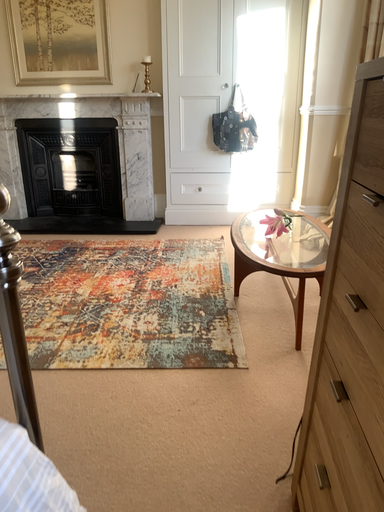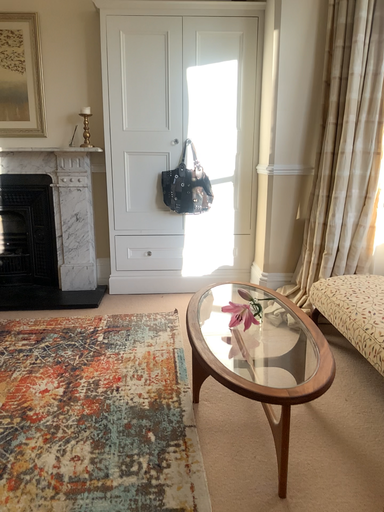
Question: Which way did the camera rotate in the video?

Choices:
 (A) rotated left
 (B) rotated right

Answer: (B)